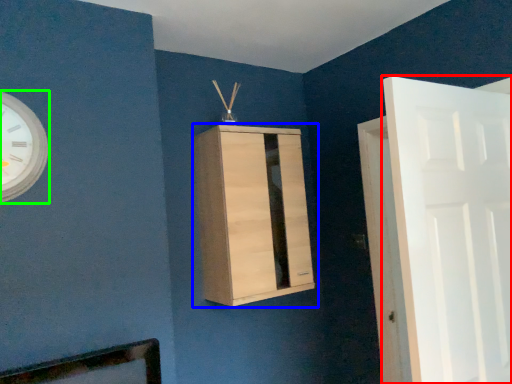
Question: Which object is the farthest from door (highlighted by a red box)? Choose among these: cupboard (highlighted by a blue box) or wall clock (highlighted by a green box).

Choices:
 (A) cupboard
 (B) wall clock

Answer: (B)